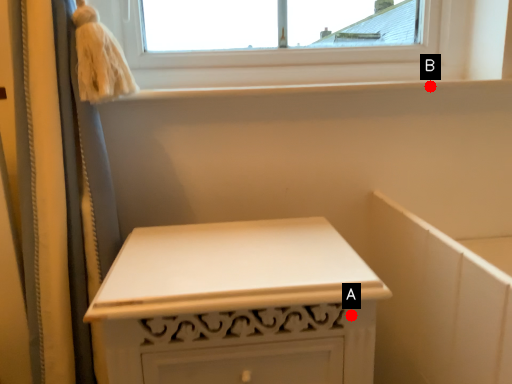
Question: Two points are circled on the image, labeled by A and B beside each circle. Which point is farther from the camera taking this photo?

Choices:
 (A) A is further
 (B) B is further

Answer: (B)